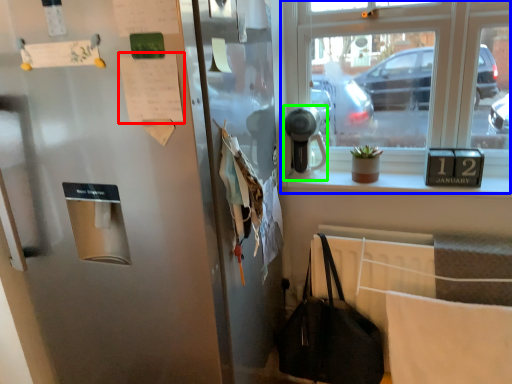
Question: Based on their relative distances, which object is nearer to paper (highlighted by a red box)? Choose from window (highlighted by a blue box) and appliance (highlighted by a green box).

Choices:
 (A) window
 (B) appliance

Answer: (B)